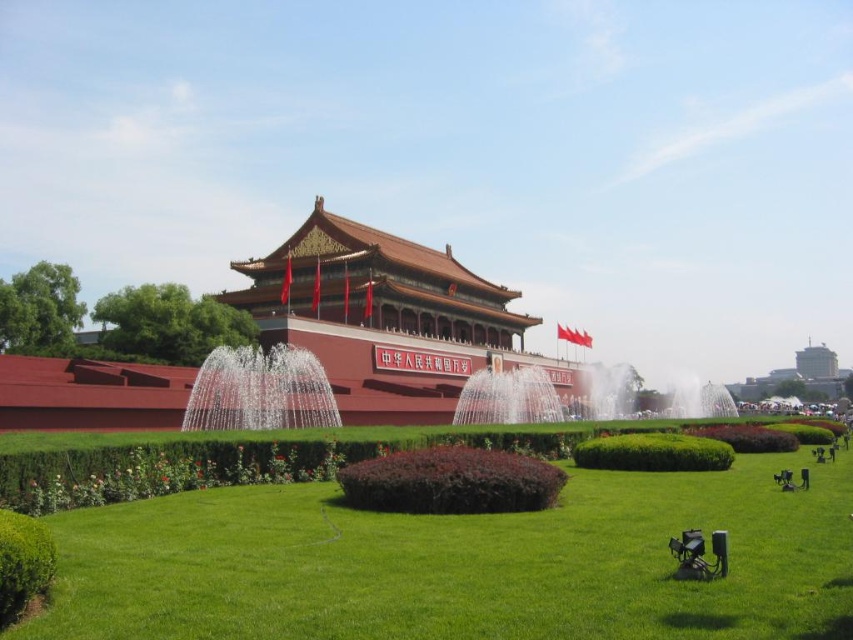
Can you confirm if green grass at center is positioned below reddish-brown stone palace at center?

Yes, green grass at center is below reddish-brown stone palace at center.

In the scene shown: Is green grass at center positioned before reddish-brown stone palace at center?

Yes.

Is point (833, 500) farther from viewer compared to point (421, 408)?

No, (833, 500) is closer to viewer.

What are the coordinates of `green grass at center` in the screenshot? It's located at (462, 563).

Which is below, green grass at center or white water at center?

green grass at center

This screenshot has width=853, height=640. Find the location of `green grass at center`. green grass at center is located at coordinates (462, 563).

Based on the photo, who is more distant from viewer, (274, 512) or (517, 365)?

The point (517, 365) is more distant.

Locate an element on the screen. The height and width of the screenshot is (640, 853). green grass at center is located at coordinates (462, 563).

Can you confirm if green grass at center is positioned above clear water fountain at center?

Incorrect, green grass at center is not positioned above clear water fountain at center.

Is green grass at center smaller than clear water fountain at center?

Incorrect, green grass at center is not smaller in size than clear water fountain at center.

Is point (793, 532) closer to camera compared to point (238, 369)?

Yes, point (793, 532) is in front of point (238, 369).

This screenshot has height=640, width=853. In order to click on green grass at center in this screenshot , I will do `click(462, 563)`.